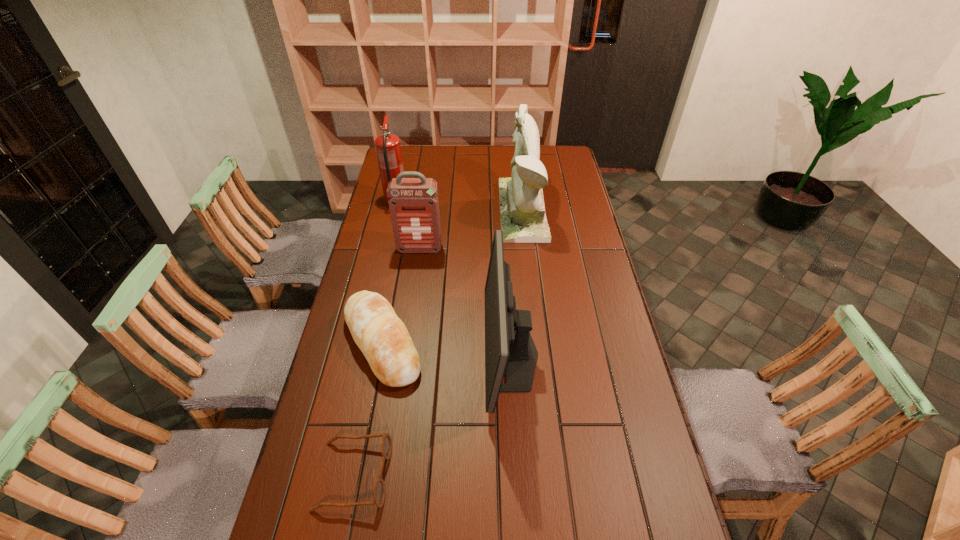
Find the location of a particular element. This screenshot has height=540, width=960. sculpture is located at coordinates (523, 219).

This screenshot has width=960, height=540. What are the coordinates of `fire extinguisher` in the screenshot? It's located at pyautogui.click(x=388, y=149).

Find the location of `the fourth nearest object`. the fourth nearest object is located at coordinates (413, 202).

Identify the location of computer monitor. (509, 348).

In order to click on bread in this screenshot , I will do `click(382, 337)`.

Where is `the shortest object`? This screenshot has height=540, width=960. the shortest object is located at coordinates (386, 445).

Where is `spectacles`? This screenshot has width=960, height=540. spectacles is located at coordinates (386, 445).

Where is `free space located 0.230m on the base of the sculpture`? The width and height of the screenshot is (960, 540). free space located 0.230m on the base of the sculpture is located at coordinates (447, 211).

Identify the location of vacant region located 0.180m on the base of the sculpture. This screenshot has width=960, height=540. (459, 211).

Where is `free space located 0.100m on the base of the sculpture`? Image resolution: width=960 pixels, height=540 pixels. free space located 0.100m on the base of the sculpture is located at coordinates (477, 211).